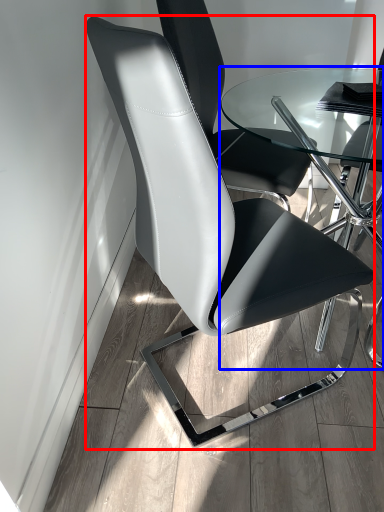
Question: Which object is closer to the camera taking this photo, chair (highlighted by a red box) or table (highlighted by a blue box)?

Choices:
 (A) chair
 (B) table

Answer: (A)